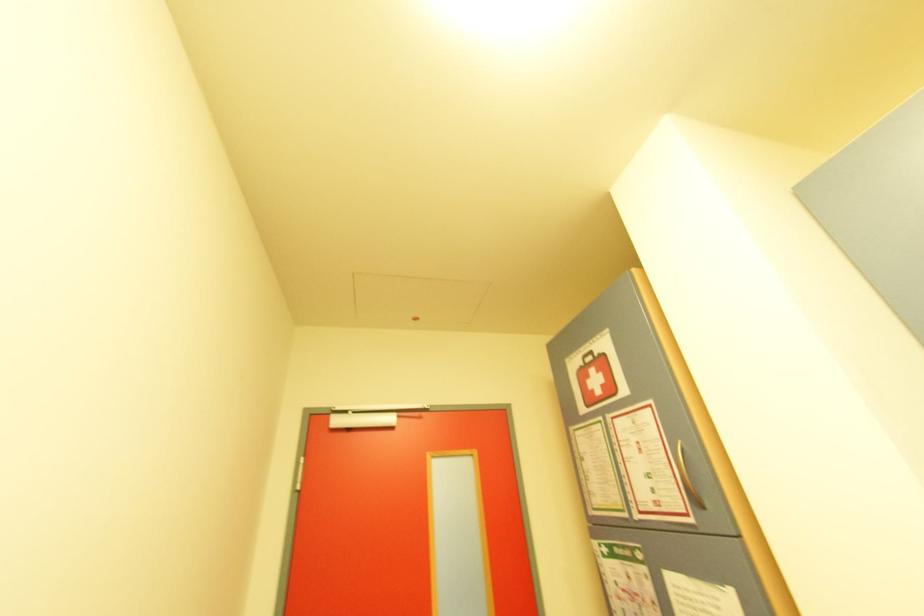
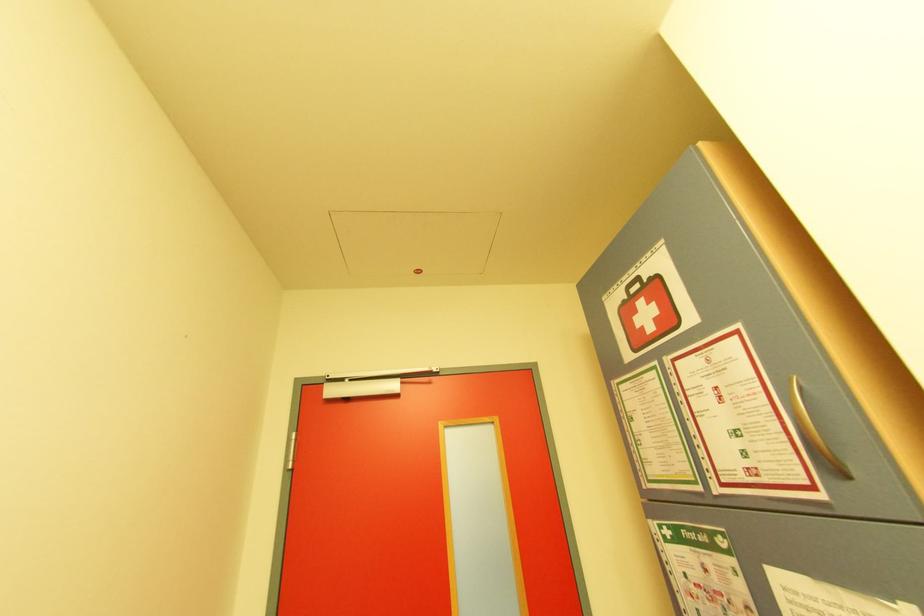
Question: The camera is either moving clockwise (left) or counter-clockwise (right) around the object. The first image is from the beginning of the video and the second image is from the end. Is the camera moving left or right when shooting the video?

Choices:
 (A) Left
 (B) Right

Answer: (B)